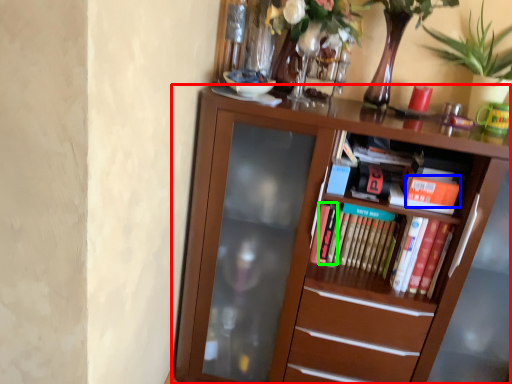
Question: Which object is positioned farthest from bookcase (highlighted by a red box)? Select from paperback book (highlighted by a blue box) and paperback book (highlighted by a green box).

Choices:
 (A) paperback book
 (B) paperback book

Answer: (A)